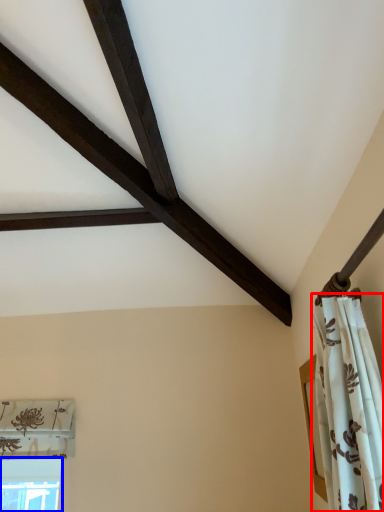
Question: Which object is further to the camera taking this photo, curtain (highlighted by a red box) or window (highlighted by a blue box)?

Choices:
 (A) curtain
 (B) window

Answer: (B)